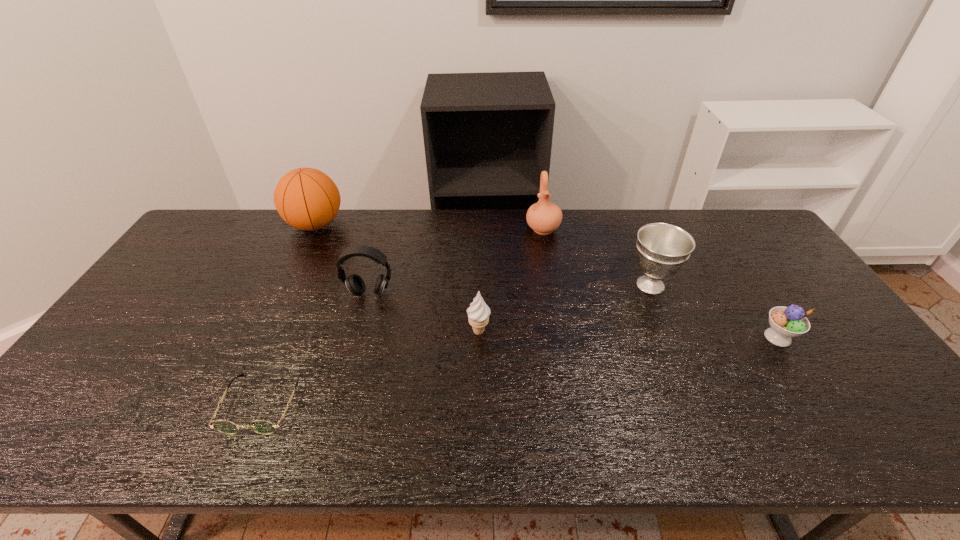
What are the coordinates of `vacant space that is in between the left icecream and the earphone` in the screenshot? It's located at (424, 312).

Identify the location of empty location between the nearest object and the left icecream. (371, 367).

Where is `vacant point located between the pottery and the second object from right to left`? The height and width of the screenshot is (540, 960). vacant point located between the pottery and the second object from right to left is located at coordinates (596, 257).

This screenshot has width=960, height=540. In order to click on vacant space in between the shorter icecream and the basketball in this screenshot , I will do `click(546, 281)`.

Where is `free space between the chalice and the pottery`? The image size is (960, 540). free space between the chalice and the pottery is located at coordinates (596, 257).

Point out which object is positioned as the fifth nearest to the fifth object from left to right. Please provide its 2D coordinates. Your answer should be formatted as a tuple, i.e. [(x, y)], where the tuple contains the x and y coordinates of a point satisfying the conditions above.

[(307, 199)]

In order to click on object that is the fifth closest to the earphone in this screenshot , I will do `click(662, 249)`.

Find the location of a particular element. The image size is (960, 540). vacant space that satisfies the following two spatial constraints: 1. on the front-facing side of the right icecream; 2. on the right side of the fourth object from left to right is located at coordinates (479, 338).

Locate an element on the screen. The width and height of the screenshot is (960, 540). vacant space that satisfies the following two spatial constraints: 1. on the front-facing side of the taller icecream; 2. on the right side of the shorter icecream is located at coordinates (479, 338).

Identify the location of free spot that satisfies the following two spatial constraints: 1. on the front-facing side of the left icecream; 2. on the lenses of the spectacles. (478, 403).